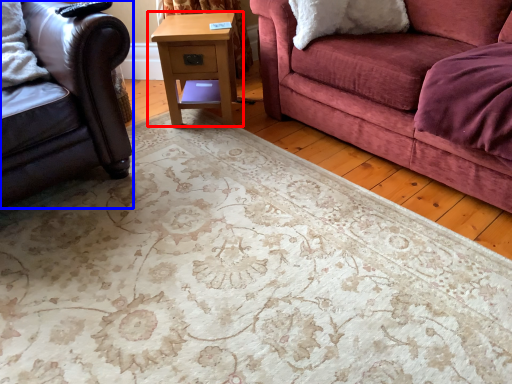
Question: Which point is further to the camera, table (highlighted by a red box) or studio couch (highlighted by a blue box)?

Choices:
 (A) table
 (B) studio couch

Answer: (A)